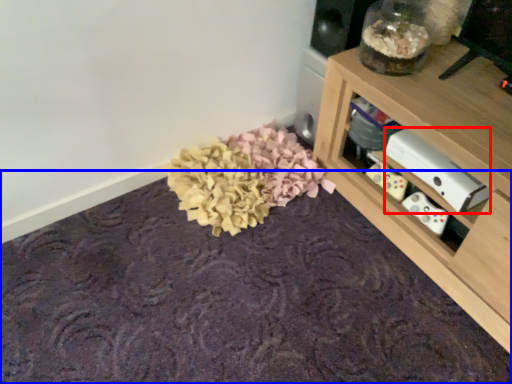
Question: Which object appears closest to the camera in this image, appliance (highlighted by a red box) or mat (highlighted by a blue box)?

Choices:
 (A) appliance
 (B) mat

Answer: (B)